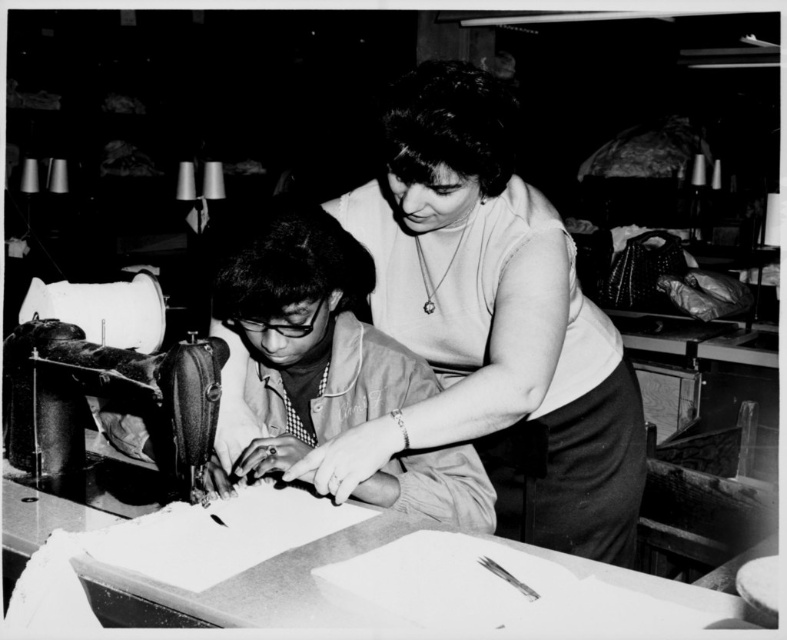
From the picture: You are a tailor working on the smooth beige shirt at center and the metallic sewing machine at left. Which object is closer to you?

The smooth beige shirt at center is closer to you than the metallic sewing machine at left.

You are a tailor working in this workshop and need to place a new fabric roll on the workbench. The metallic sewing machine at left is currently in use. Where should you place the fabric roll so it doesn not interfere with the smooth white blouse at center?

The smooth white blouse at center is located below the metallic sewing machine at left. To avoid interference, place the fabric roll above or to the side of the metallic sewing machine at left, away from the blouse.